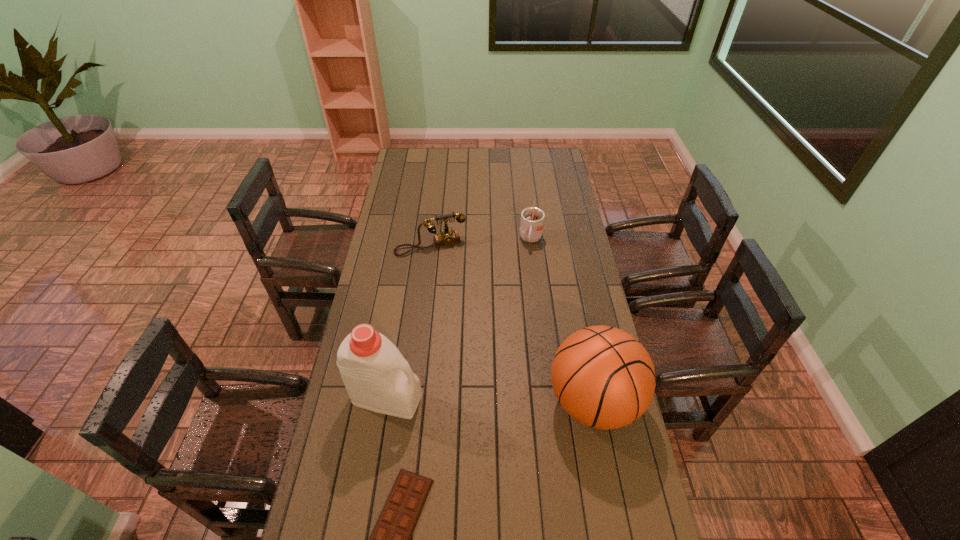
Where is `free space on the desktop that is between the nearest object and the basketball and is positioned on the front-facing side of the telephone`? free space on the desktop that is between the nearest object and the basketball and is positioned on the front-facing side of the telephone is located at coordinates (504, 453).

The height and width of the screenshot is (540, 960). In order to click on free space on the desktop that is between the chocolate bar and the basketball and is positioned on the side with the handle of the cup in this screenshot , I will do `click(497, 456)`.

The height and width of the screenshot is (540, 960). I want to click on vacant space on the desktop that is between the shortest object and the basketball and is positioned on the handle side of the detergent, so click(531, 437).